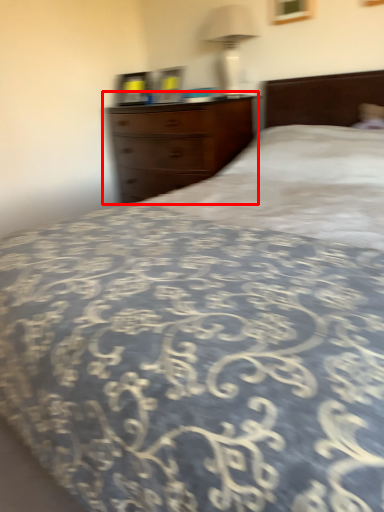
Question: From the image's perspective, where is chest of drawers (annotated by the red box) located relative to bedside lamp?

Choices:
 (A) below
 (B) above

Answer: (A)